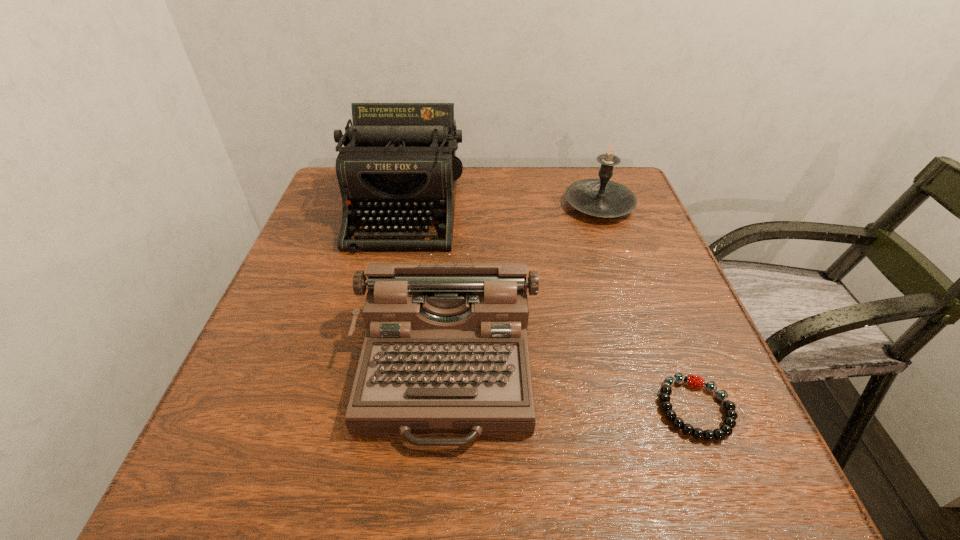
Image resolution: width=960 pixels, height=540 pixels. I want to click on free area in between the shortest object and the shorter typewriter, so 570,389.

Identify the location of free space between the tallest object and the candle. (502, 207).

The height and width of the screenshot is (540, 960). What are the coordinates of `empty location between the shortest object and the candle` in the screenshot? It's located at (647, 307).

The width and height of the screenshot is (960, 540). I want to click on vacant space in between the candle and the taller typewriter, so click(x=502, y=207).

You are a GUI agent. You are given a task and a screenshot of the screen. Output one action in this format:
    pyautogui.click(x=<x>, y=<y>)
    Task: Click on the vacant space that's between the candle and the bracelet
    Image resolution: width=960 pixels, height=540 pixels.
    Given the screenshot: What is the action you would take?
    pyautogui.click(x=647, y=307)

Identify the location of vacant point located between the bracelet and the tallest object. (550, 309).

Choose which object is the third nearest neighbor to the farther typewriter. Please provide its 2D coordinates. Your answer should be formatted as a tuple, i.e. [(x, y)], where the tuple contains the x and y coordinates of a point satisfying the conditions above.

[(726, 429)]

Locate which object is the second closest to the farther typewriter. Please provide its 2D coordinates. Your answer should be formatted as a tuple, i.e. [(x, y)], where the tuple contains the x and y coordinates of a point satisfying the conditions above.

[(601, 197)]

At what (x,y) coordinates should I click in order to perform the action: click on free spot that satisfies the following two spatial constraints: 1. on the keyboard of the bracelet; 2. on the right side of the tallest object. Please return your answer as a coordinate pair (x, y). This screenshot has height=540, width=960. Looking at the image, I should click on (361, 409).